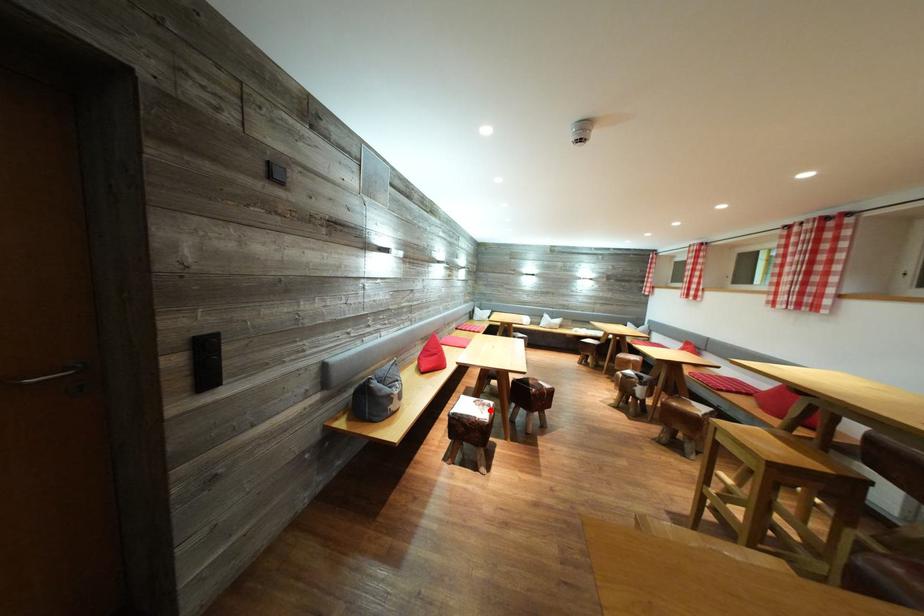
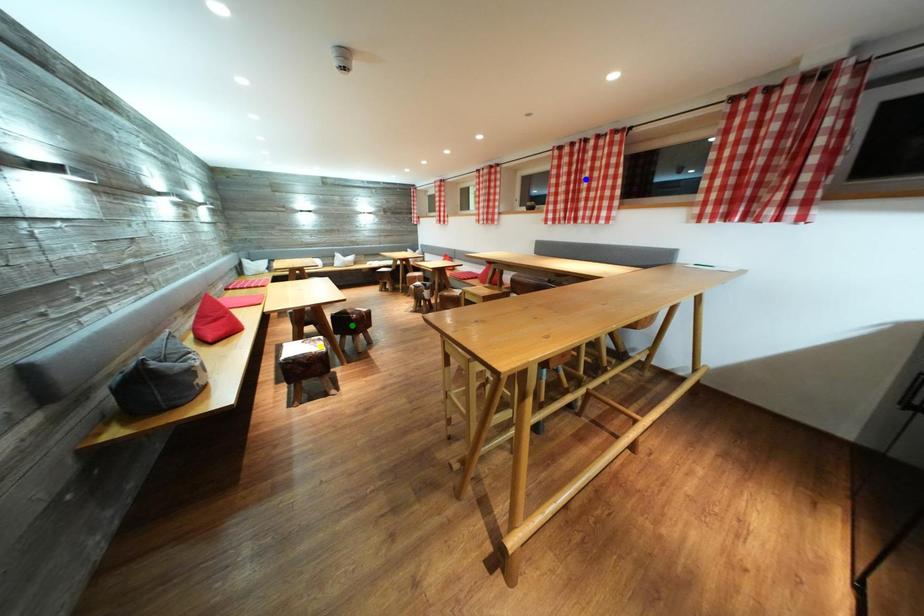
Question: I am providing you with two images of the same scene from different viewpoints. A red point is marked on the first image. You are given multiple points on the second image. In image 2, which mark is for the same physical point as the one in image 1?

Choices:
 (A) blue point
 (B) yellow point
 (C) green point

Answer: (B)